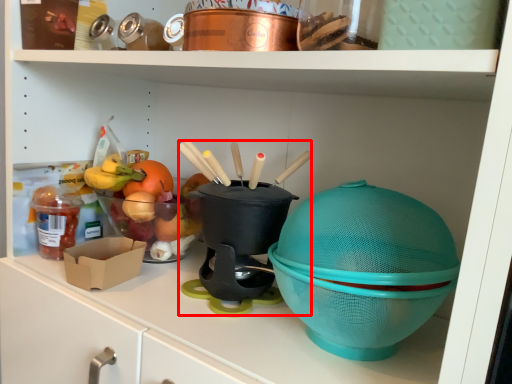
Question: From the image's perspective, considering the relative positions of appliance (annotated by the red box) and food in the image provided, where is appliance (annotated by the red box) located with respect to the staircase?

Choices:
 (A) below
 (B) above

Answer: (B)